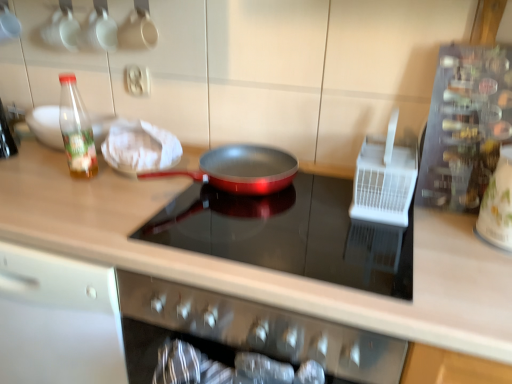
Locate an element on the screen. The height and width of the screenshot is (384, 512). vacant space to the left of transparent plastic bottle at left is located at coordinates [x=36, y=173].